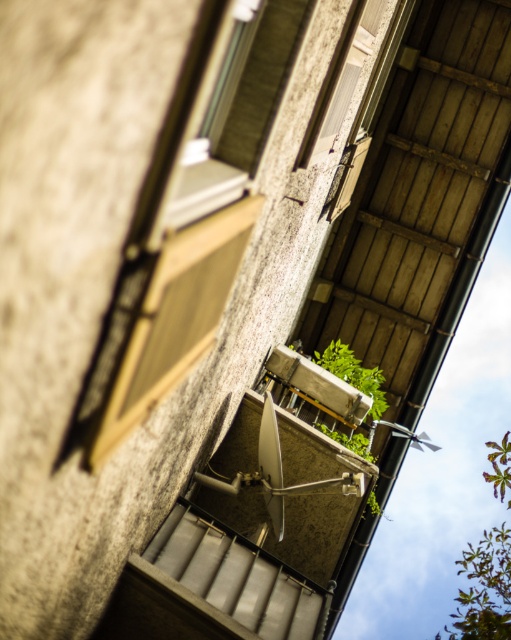
Question: Which object is the farthest from the wooden window frame at upper center?

Choices:
 (A) green leafy plant at center
 (B) green leafy plant at lower right

Answer: (B)

Question: Which object is positioned closest to the green leafy plant at lower right?

Choices:
 (A) green leafy plant at center
 (B) wooden window frame at upper center

Answer: (A)

Question: Is green leafy plant at lower right below wooden window frame at upper center?

Choices:
 (A) no
 (B) yes

Answer: (B)

Question: Does wooden window frame at upper center have a larger size compared to green leafy plant at center?

Choices:
 (A) yes
 (B) no

Answer: (A)

Question: Which is nearer to the green leafy plant at center?

Choices:
 (A) wooden window frame at upper center
 (B) green leafy plant at lower right

Answer: (A)

Question: Is wooden window frame at upper center to the right of green leafy plant at center from the viewer's perspective?

Choices:
 (A) yes
 (B) no

Answer: (B)